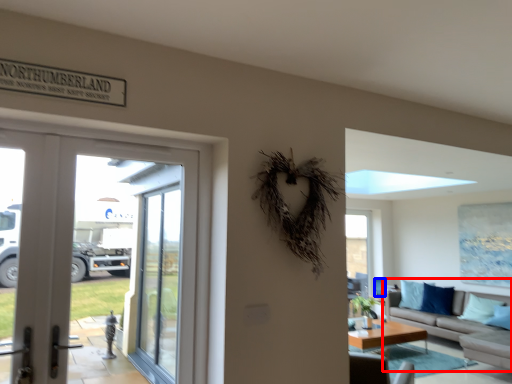
Question: Which object is further to the camera taking this photo, studio couch (highlighted by a red box) or armchair (highlighted by a blue box)?

Choices:
 (A) studio couch
 (B) armchair

Answer: (B)